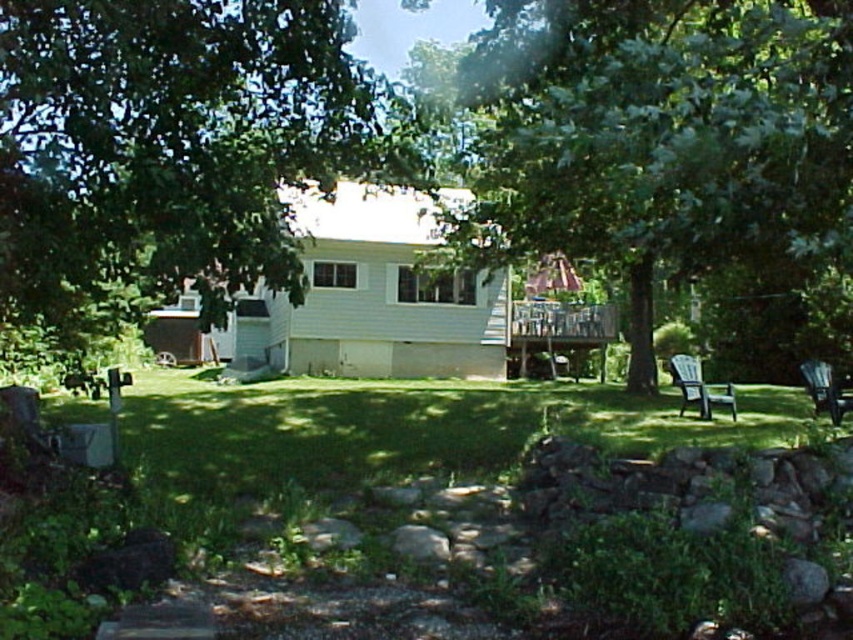
You are standing at the entrance of the house and want to take a photo of the green leafy tree at upper left. Which direction should you face to capture it in the frame?

You should face the upper left direction to capture the green leafy tree at upper left in your photo since it is located at point (178, 147).

You are planning to host a small gathering in your backyard and need to seat guests. You have two chairs available, the green plastic chair at right and the black plastic chair at lower right. Which chair would be more suitable for a taller guest?

The green plastic chair at right is larger in size compared to the black plastic chair at lower right, making it more suitable for a taller guest.